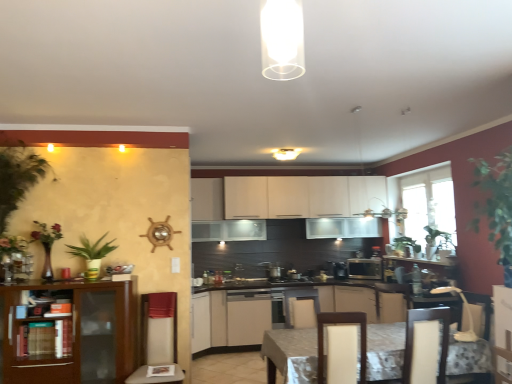
This screenshot has height=384, width=512. What do you see at coordinates (342, 347) in the screenshot?
I see `light brown wood swivel chair at center, arranged as the 2th swivel chair when viewed from the right` at bounding box center [342, 347].

Where is `white matte ceiling light at center`? white matte ceiling light at center is located at coordinates (286, 154).

Describe the element at coordinates (503, 334) in the screenshot. The image size is (512, 384). I see `white glossy cabinet at center, acting as the fifth cabinetry starting from the back` at that location.

The image size is (512, 384). I want to click on white glossy cabinet at center, acting as the fifth cabinetry starting from the back, so click(503, 334).

I want to click on black plastic coffee machine at center, so click(x=337, y=270).

Describe the element at coordinates (337, 270) in the screenshot. The width and height of the screenshot is (512, 384). I see `black plastic coffee machine at center` at that location.

At what (x,y) coordinates should I click in order to perform the action: click on black matte stove at center. Please return your answer as a coordinate pair (x, y). This screenshot has width=512, height=384. Looking at the image, I should click on (291, 281).

You are a GUI agent. You are given a task and a screenshot of the screen. Output one action in this format:
    pyautogui.click(x=<x>, y=<y>)
    Task: Click on the light brown wood swivel chair at center, arranged as the 2th swivel chair when viewed from the right
    
    Given the screenshot: What is the action you would take?
    pyautogui.click(x=342, y=347)

Is point (75, 371) less distant than point (291, 280)?

Yes, point (75, 371) is in front of point (291, 280).

Do you think wooden bookshelf at left is within black matte stove at center, or outside of it?

The correct answer is: outside.

Looking at this image, who is smaller, wooden bookshelf at left or black matte stove at center?

black matte stove at center is smaller.

Can you confirm if wooden bookshelf at left is shorter than black matte stove at center?

No.

From a real-world perspective, is beige fabric swivel chair at left, acting as the third swivel chair starting from the right, below white matte cabinet at center, acting as the 3th cabinetry starting from the front?

Incorrect, from a real-world perspective, beige fabric swivel chair at left, acting as the third swivel chair starting from the right, is higher than white matte cabinet at center, acting as the 3th cabinetry starting from the front.

Do you think beige fabric swivel chair at left, which ranks as the first swivel chair in left-to-right order, is within white matte cabinet at center, acting as the 3th cabinetry starting from the front, or outside of it?

beige fabric swivel chair at left, which ranks as the first swivel chair in left-to-right order, is not enclosed by white matte cabinet at center, acting as the 3th cabinetry starting from the front.

What are the coordinates of `swivel chair on the left of white matte cabinet at center, acting as the third cabinetry starting from the back` in the screenshot? It's located at (158, 340).

Is point (147, 297) in front of point (200, 318)?

That is True.

Between point (145, 304) and point (497, 355), which one is positioned in front?

The point (497, 355) is more forward.

Looking at this image, can you confirm if beige fabric swivel chair at left, acting as the third swivel chair starting from the right, is bigger than white glossy cabinet at center, acting as the fifth cabinetry starting from the back?

Yes.

At what (x,y) coordinates should I click in order to perform the action: click on the 1st cabinetry above when counting from the beige fabric swivel chair at left, which ranks as the first swivel chair in left-to-right order (from the image's perspective). Please return your answer as a coordinate pair (x, y). This screenshot has width=512, height=384. Looking at the image, I should click on (503, 334).

Considering the relative positions of beige fabric swivel chair at left, which ranks as the first swivel chair in left-to-right order, and white glossy cabinet at center, acting as the fifth cabinetry starting from the back, in the image provided, is beige fabric swivel chair at left, which ranks as the first swivel chair in left-to-right order, to the left or to the right of white glossy cabinet at center, acting as the fifth cabinetry starting from the back,?

Based on their positions, beige fabric swivel chair at left, which ranks as the first swivel chair in left-to-right order, is located to the left of white glossy cabinet at center, acting as the fifth cabinetry starting from the back.

The image size is (512, 384). I want to click on lighting located on the right of green leafy plant at left, so click(286, 154).

Is green leafy plant at left oriented away from white matte ceiling light at center?

No, green leafy plant at left is not facing away from white matte ceiling light at center.

Can we say green leafy plant at left lies outside white matte ceiling light at center?

green leafy plant at left lies outside white matte ceiling light at center's area.

Considering the relative sizes of green leafy plant at left and white matte ceiling light at center in the image provided, is green leafy plant at left thinner than white matte ceiling light at center?

Yes, green leafy plant at left is thinner than white matte ceiling light at center.

From the picture: Considering the relative positions of white plastic swivel chair at lower right, which is counted as the 3th swivel chair, starting from the left, and satin silver microwave at center in the image provided, is white plastic swivel chair at lower right, which is counted as the 3th swivel chair, starting from the left, to the left or to the right of satin silver microwave at center?

white plastic swivel chair at lower right, which is counted as the 3th swivel chair, starting from the left, is positioned on satin silver microwave at center's left side.

Where is `swivel chair that is the 1st object to the left of the satin silver microwave at center, starting at the anchor`? The height and width of the screenshot is (384, 512). swivel chair that is the 1st object to the left of the satin silver microwave at center, starting at the anchor is located at coordinates (466, 315).

Is white plastic swivel chair at lower right, which is counted as the 3th swivel chair, starting from the left, turned away from satin silver microwave at center?

white plastic swivel chair at lower right, which is counted as the 3th swivel chair, starting from the left, does not have its back to satin silver microwave at center.

Is white plastic swivel chair at lower right, which is counted as the 3th swivel chair, starting from the left, bigger than satin silver microwave at center?

No, white plastic swivel chair at lower right, which is counted as the 3th swivel chair, starting from the left, is not bigger than satin silver microwave at center.

Does black matte stove at center have a larger size compared to white plastic swivel chair at lower right, marked as the 1th swivel chair in a right-to-left arrangement?

No.

Is black matte stove at center outside of white plastic swivel chair at lower right, marked as the 1th swivel chair in a right-to-left arrangement?

Yes, black matte stove at center is located beyond the bounds of white plastic swivel chair at lower right, marked as the 1th swivel chair in a right-to-left arrangement.

Which object is thinner, black matte stove at center or white plastic swivel chair at lower right, marked as the 1th swivel chair in a right-to-left arrangement?

Thinner between the two is white plastic swivel chair at lower right, marked as the 1th swivel chair in a right-to-left arrangement.

Consider the image. Is black matte stove at center oriented towards white plastic swivel chair at lower right, marked as the 1th swivel chair in a right-to-left arrangement?

Yes, black matte stove at center is oriented towards white plastic swivel chair at lower right, marked as the 1th swivel chair in a right-to-left arrangement.

Considering the relative positions of green leafy plant at left and satin silver microwave at center in the image provided, is green leafy plant at left to the right of satin silver microwave at center from the viewer's perspective?

In fact, green leafy plant at left is to the left of satin silver microwave at center.

Does point (13, 194) lie behind point (361, 273)?

No, (13, 194) is closer to viewer.

Is green leafy plant at left not inside satin silver microwave at center?

Yes.

This screenshot has height=384, width=512. I want to click on plant in front of the satin silver microwave at center, so click(17, 176).

Identify the location of stove located on the right of wooden bookshelf at left. (291, 281).

Locate an element on the screen. The width and height of the screenshot is (512, 384). cabinetry that is the 3rd one below the beige fabric swivel chair at left, which ranks as the first swivel chair in left-to-right order (from a real-world perspective) is located at coordinates (200, 322).

From the picture: Considering their positions, is satin silver microwave at center positioned closer to matte white cabinets at center, the 2th cabinetry viewed from the front, than wooden bookshelf at left?

satin silver microwave at center lies closer to matte white cabinets at center, the 2th cabinetry viewed from the front, than the other object.

Considering their positions, is white glossy cabinet at center, acting as the fifth cabinetry starting from the back, positioned closer to green leafy plant at left than white matte ceiling light at center?

white matte ceiling light at center is closer to green leafy plant at left.

Considering their positions, is wooden bookshelf at left positioned closer to white matte cabinet at center, the 4th cabinetry in the front-to-back sequence, than white matte cabinet at center, acting as the 3th cabinetry starting from the front?

white matte cabinet at center, acting as the 3th cabinetry starting from the front, is positioned closer to the anchor white matte cabinet at center, the 4th cabinetry in the front-to-back sequence.

Estimate the real-world distances between objects in this image. Which object is closer to marble-patterned table at center, light brown wood swivel chair at center, arranged as the 2th swivel chair when viewed from the right, or matte white cabinets at center, the 4th cabinetry in the back-to-front sequence?

Among the two, light brown wood swivel chair at center, arranged as the 2th swivel chair when viewed from the right, is located nearer to marble-patterned table at center.

Which object lies further to the anchor point white glossy cabinets at center, positioned as the 1th cabinetry in back-to-front order, satin silver toaster at center or white plastic swivel chair at lower right, which is counted as the 3th swivel chair, starting from the left?

The object further to white glossy cabinets at center, positioned as the 1th cabinetry in back-to-front order, is white plastic swivel chair at lower right, which is counted as the 3th swivel chair, starting from the left.

From the image, which object appears to be farther from white glossy cabinet at center, acting as the fifth cabinetry starting from the back, beige fabric swivel chair at left, which ranks as the first swivel chair in left-to-right order, or light brown wood swivel chair at center, acting as the second swivel chair starting from the left?

Among the two, beige fabric swivel chair at left, which ranks as the first swivel chair in left-to-right order, is located further to white glossy cabinet at center, acting as the fifth cabinetry starting from the back.

Estimate the real-world distances between objects in this image. Which object is further from white glossy cabinets at center, positioned as the 1th cabinetry in back-to-front order, marble-patterned table at center or white matte cabinet at center, acting as the 3th cabinetry starting from the front?

marble-patterned table at center lies further to white glossy cabinets at center, positioned as the 1th cabinetry in back-to-front order, than the other object.

Looking at the image, which one is located further to wooden bookshelf at left, white plastic swivel chair at lower right, which is counted as the 3th swivel chair, starting from the left, or light brown wood swivel chair at center, acting as the second swivel chair starting from the left?

Among the two, white plastic swivel chair at lower right, which is counted as the 3th swivel chair, starting from the left, is located further to wooden bookshelf at left.

Where is `lighting between wooden bookshelf at left and marble-patterned table at center from left to right`? This screenshot has width=512, height=384. lighting between wooden bookshelf at left and marble-patterned table at center from left to right is located at coordinates (286, 154).

This screenshot has width=512, height=384. What are the coordinates of `cabinetry situated between black matte stove at center and satin silver microwave at center from left to right` in the screenshot? It's located at (290, 196).

You are a GUI agent. You are given a task and a screenshot of the screen. Output one action in this format:
    pyautogui.click(x=<x>, y=<y>)
    Task: Click on the swivel chair between green leafy plant at left and light brown wood swivel chair at center, arranged as the 2th swivel chair when viewed from the right
    
    Given the screenshot: What is the action you would take?
    pyautogui.click(x=158, y=340)

Find the location of `coffee machine situated between beige fabric swivel chair at left, which ranks as the first swivel chair in left-to-right order, and transparent glass window at right from left to right`. coffee machine situated between beige fabric swivel chair at left, which ranks as the first swivel chair in left-to-right order, and transparent glass window at right from left to right is located at coordinates (337, 270).